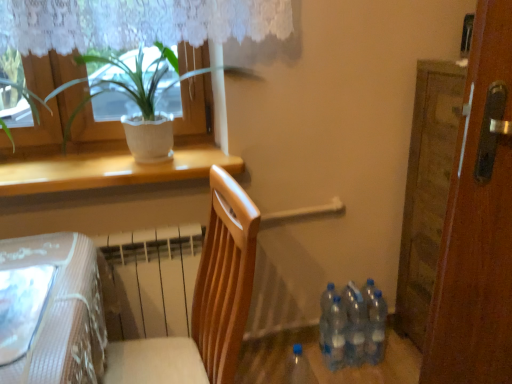
Question: Can you confirm if green leafy plant at upper left is bigger than blue translucent bottle at lower center, placed as the 5th bottle when sorted from right to left?

Choices:
 (A) no
 (B) yes

Answer: (B)

Question: Are green leafy plant at upper left and blue translucent bottle at lower center, placed as the 5th bottle when sorted from right to left, beside each other?

Choices:
 (A) yes
 (B) no

Answer: (B)

Question: Is blue translucent bottle at lower center, placed as the 5th bottle when sorted from right to left, located within green leafy plant at upper left?

Choices:
 (A) no
 (B) yes

Answer: (A)

Question: Considering the relative sizes of green leafy plant at upper left and blue translucent bottle at lower center, the 1th bottle from the left, in the image provided, is green leafy plant at upper left taller than blue translucent bottle at lower center, the 1th bottle from the left,?

Choices:
 (A) no
 (B) yes

Answer: (B)

Question: Considering the relative sizes of green leafy plant at upper left and blue translucent bottle at lower center, the 1th bottle from the left, in the image provided, is green leafy plant at upper left wider than blue translucent bottle at lower center, the 1th bottle from the left,?

Choices:
 (A) no
 (B) yes

Answer: (B)

Question: From a real-world perspective, is translucent plastic bottles at lower right, which is the 4th bottle from left to right, above or below wooden door at right?

Choices:
 (A) above
 (B) below

Answer: (B)

Question: Is translucent plastic bottles at lower right, which is the 4th bottle from left to right, inside or outside of wooden door at right?

Choices:
 (A) outside
 (B) inside

Answer: (A)

Question: In terms of size, does translucent plastic bottles at lower right, marked as the 2th bottle in a right-to-left arrangement, appear bigger or smaller than wooden door at right?

Choices:
 (A) small
 (B) big

Answer: (A)

Question: Considering the positions of point pos(348,331) and point pos(466,142), is point pos(348,331) closer or farther from the camera than point pos(466,142)?

Choices:
 (A) farther
 (B) closer

Answer: (A)

Question: Considering their positions, is wooden door at right located in front of or behind transparent plastic bottles at lower right, which ranks as the third bottle in right-to-left order?

Choices:
 (A) front
 (B) behind

Answer: (A)

Question: In terms of width, does wooden door at right look wider or thinner when compared to transparent plastic bottles at lower right, arranged as the third bottle when viewed from the left?

Choices:
 (A) wide
 (B) thin

Answer: (A)

Question: In the image, is wooden door at right on the left side or the right side of transparent plastic bottles at lower right, arranged as the third bottle when viewed from the left?

Choices:
 (A) left
 (B) right

Answer: (B)

Question: Would you say wooden door at right is inside or outside transparent plastic bottles at lower right, which ranks as the third bottle in right-to-left order?

Choices:
 (A) outside
 (B) inside

Answer: (A)

Question: Visually, is wooden chair at center positioned to the left or to the right of green leafy plant at upper left?

Choices:
 (A) left
 (B) right

Answer: (B)

Question: From the image's perspective, is wooden chair at center located above or below green leafy plant at upper left?

Choices:
 (A) below
 (B) above

Answer: (A)